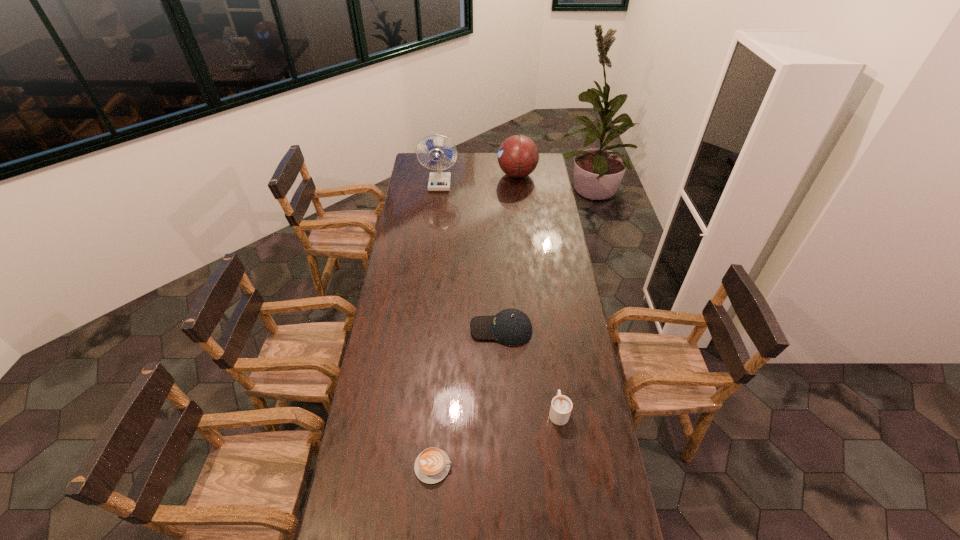
Identify the location of fan. (438, 181).

What are the coordinates of `the second tallest object` in the screenshot? It's located at (518, 156).

In order to click on the third farthest object in this screenshot , I will do `click(512, 327)`.

Locate an element on the screen. The height and width of the screenshot is (540, 960). the fourth farthest object is located at coordinates (561, 406).

In order to click on the farther cappuccino in this screenshot , I will do `click(561, 406)`.

Where is `the nearest object`? The image size is (960, 540). the nearest object is located at coordinates (432, 465).

I want to click on the shorter cappuccino, so [432, 465].

This screenshot has height=540, width=960. In order to click on vacant space located on the front-facing side of the fan in this screenshot , I will do `click(436, 219)`.

Where is `free space located 0.350m on the front of the basketball`? free space located 0.350m on the front of the basketball is located at coordinates (522, 223).

Find the location of a particular element. vacant space located 0.370m on the front-facing side of the baseball cap is located at coordinates (382, 329).